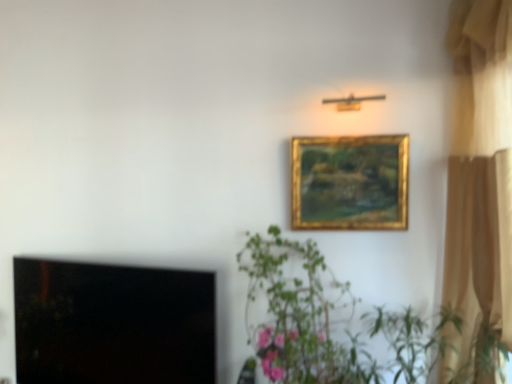
Question: From the image's perspective, is beige fabric curtain at right above or below green leafy plant at center?

Choices:
 (A) below
 (B) above

Answer: (B)

Question: From a real-world perspective, is beige fabric curtain at right physically located above or below green leafy plant at center?

Choices:
 (A) above
 (B) below

Answer: (A)

Question: Considering the real-world distances, which object is farthest from the green leafy plant at center?

Choices:
 (A) black glass window screen at lower left
 (B) gold/gilded picture frame at upper center
 (C) green leafy plant at center
 (D) beige fabric curtain at right

Answer: (A)

Question: Estimate the real-world distances between objects in this image. Which object is farther from the black glass window screen at lower left?

Choices:
 (A) green leafy plant at center
 (B) beige fabric curtain at right
 (C) gold/gilded picture frame at upper center
 (D) green leafy plant at center

Answer: (B)